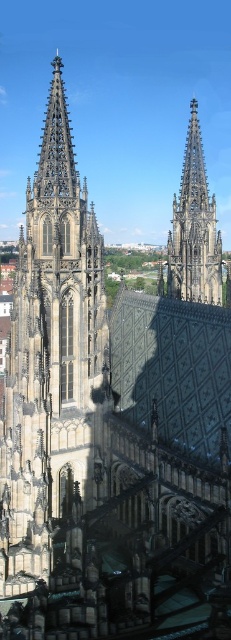
Based on the photo, is dark gray stone tower at left behind dark gray stone spire at center?

No, it is not.

Can you confirm if dark gray stone tower at left is positioned below dark gray stone spire at center?

Indeed, dark gray stone tower at left is positioned under dark gray stone spire at center.

Between point (100, 326) and point (188, 202), which one is positioned behind?

The point (188, 202) is behind.

I want to click on dark gray stone tower at left, so click(49, 355).